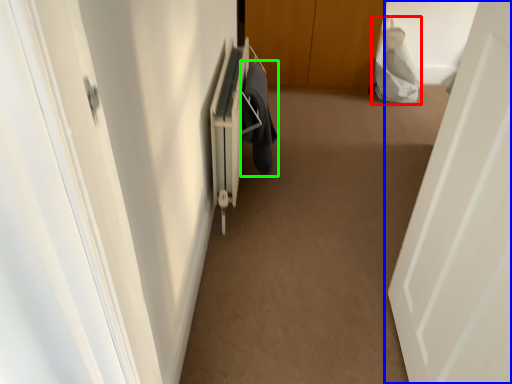
Question: Based on their relative distances, which object is farther from material (highlighted by a red box)? Choose from door (highlighted by a blue box) and laundry (highlighted by a green box).

Choices:
 (A) door
 (B) laundry

Answer: (A)